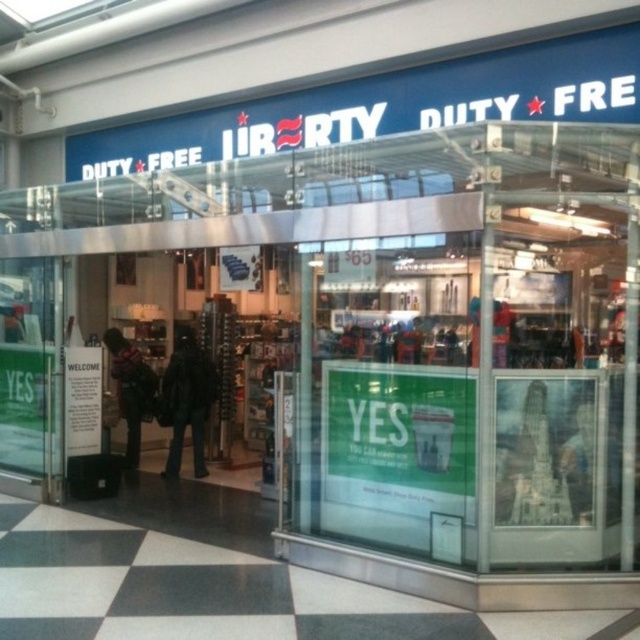
Does black fuzzy coat at center appear over dark gray sweater at left?

Incorrect, black fuzzy coat at center is not positioned above dark gray sweater at left.

How distant is black fuzzy coat at center from dark gray sweater at left?

black fuzzy coat at center and dark gray sweater at left are 21.02 inches apart from each other.

Does point (168, 460) lie behind point (129, 435)?

No, (168, 460) is closer to viewer.

At what (x,y) coordinates should I click in order to perform the action: click on black fuzzy coat at center. Please return your answer as a coordinate pair (x, y). Looking at the image, I should click on 186,400.

Find the location of `transparent glass door at left`. transparent glass door at left is located at coordinates (29, 369).

Is point (17, 372) behind point (120, 403)?

No.

This screenshot has height=640, width=640. Find the location of `transparent glass door at left`. transparent glass door at left is located at coordinates (29, 369).

Can you confirm if transparent glass door at left is thinner than black fuzzy coat at center?

No, transparent glass door at left is not thinner than black fuzzy coat at center.

Measure the distance between transparent glass door at left and black fuzzy coat at center.

transparent glass door at left and black fuzzy coat at center are 1.64 meters apart from each other.

Is point (40, 300) farther from camera compared to point (172, 444)?

No, it is in front of (172, 444).

Locate an element on the screen. The width and height of the screenshot is (640, 640). transparent glass door at left is located at coordinates (29, 369).